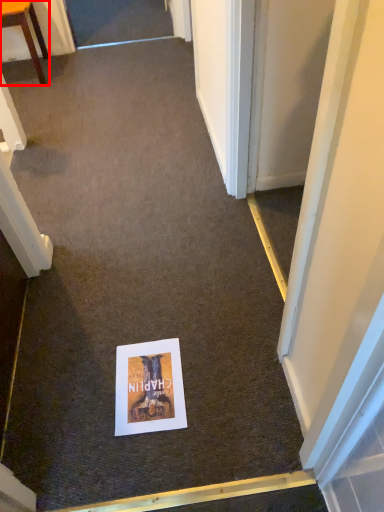
Question: Observing the image, what is the correct spatial positioning of furniture (annotated by the red box) in reference to poster page?

Choices:
 (A) right
 (B) left

Answer: (B)